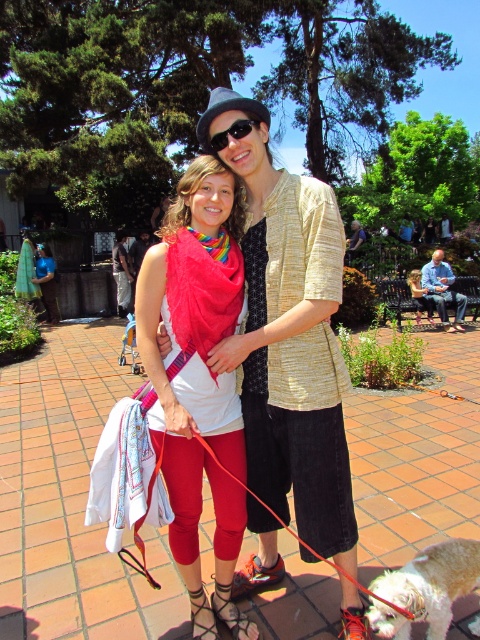
You are standing at the point labeled point [456,328] and want to walk towards the point labeled point [470,582]. Which direction should you move relative to the other point?

You should move forward towards the point [470,582] since it is in front of point [456,328].

You are a photographer trying to capture a clear photo of the blue denim shirt at center and the black plastic sunglasses at upper center. Which object should you focus on to ensure it appears larger in the photo?

The blue denim shirt at center is bigger than the black plastic sunglasses at upper center, so focusing on the blue denim shirt at center will ensure it appears larger in the photo.